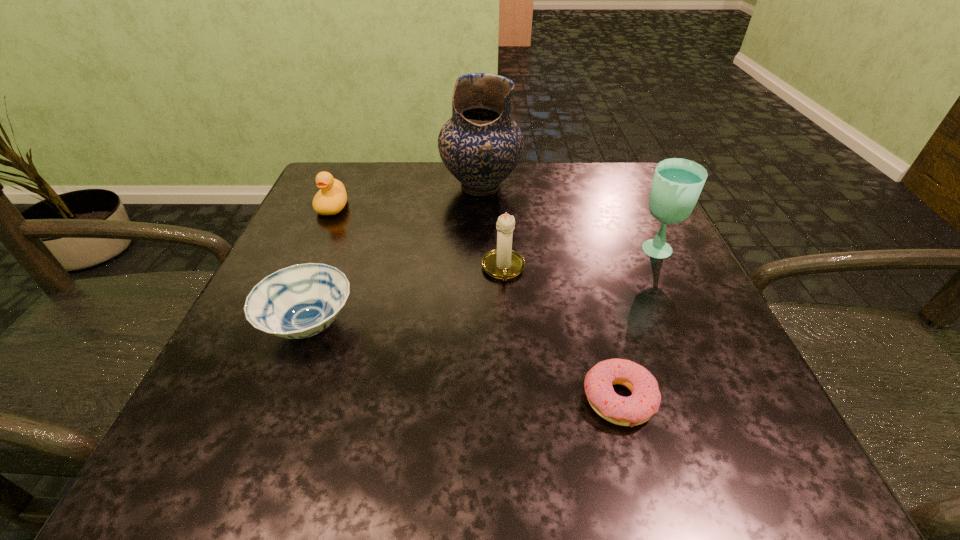
Image resolution: width=960 pixels, height=540 pixels. In order to click on glass at the right edge in this screenshot , I will do `click(677, 183)`.

This screenshot has width=960, height=540. What are the coordinates of `doughnut that is at the right edge` in the screenshot? It's located at (633, 410).

Where is `object that is positioned at the far left corner`? Image resolution: width=960 pixels, height=540 pixels. object that is positioned at the far left corner is located at coordinates (331, 198).

Identify the location of object located at the near right corner. (633, 410).

Locate an element on the screen. This screenshot has height=540, width=960. vacant area at the far edge is located at coordinates (571, 215).

The width and height of the screenshot is (960, 540). I want to click on vacant point at the near edge, so click(600, 460).

I want to click on vacant space at the left edge, so (263, 374).

Where is `vacant space at the right edge`? vacant space at the right edge is located at coordinates click(x=687, y=381).

Where is `vacant space at the far left corner of the desktop`? vacant space at the far left corner of the desktop is located at coordinates (328, 162).

The height and width of the screenshot is (540, 960). What are the coordinates of `free region at the near left corner` in the screenshot? It's located at (262, 457).